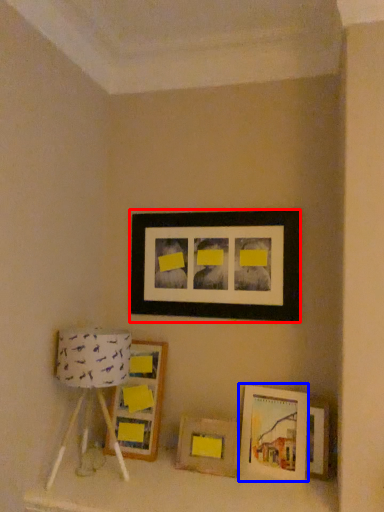
Question: Which of the following is the closest to the observer, picture frame (highlighted by a red box) or picture frame (highlighted by a blue box)?

Choices:
 (A) picture frame
 (B) picture frame

Answer: (B)